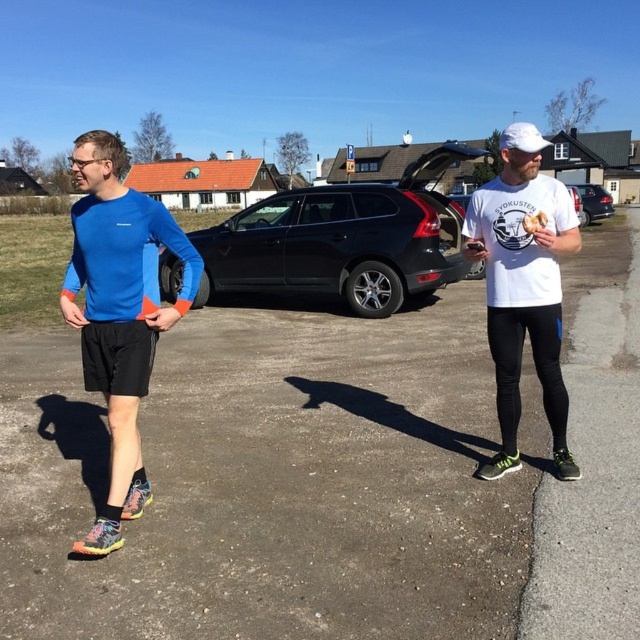
Question: Which point is farther to the camera?

Choices:
 (A) shiny black suv at center
 (B) asphalt pavement at center
 (C) white matte t-shirt at center
 (D) metallic silver hatchback at center

Answer: (A)

Question: Can you confirm if white matte t-shirt at center is smaller than golden bread at right?

Choices:
 (A) yes
 (B) no

Answer: (B)

Question: Which is farther from the golden bread at right?

Choices:
 (A) shiny black suv at center
 (B) metallic silver hatchback at center
 (C) white matte t-shirt at center

Answer: (B)

Question: From the image, what is the correct spatial relationship of asphalt pavement at center in relation to golden bread at right?

Choices:
 (A) right
 (B) left

Answer: (B)

Question: Does asphalt pavement at center appear over white matte t-shirt at center?

Choices:
 (A) no
 (B) yes

Answer: (A)

Question: Which point appears closest to the camera in this image?

Choices:
 (A) (67, 609)
 (B) (544, 227)
 (C) (112, 205)
 (D) (248, 228)

Answer: (A)